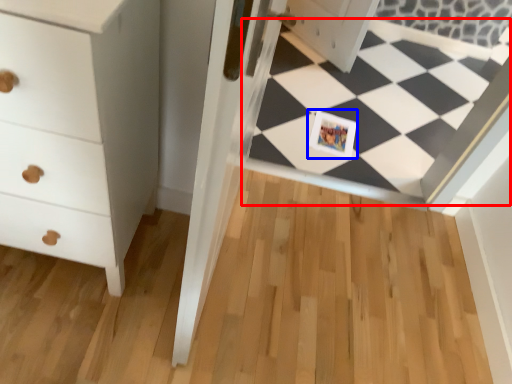
Question: Which object appears closest to the camera in this image, square (highlighted by a red box) or postcard (highlighted by a blue box)?

Choices:
 (A) square
 (B) postcard

Answer: (A)